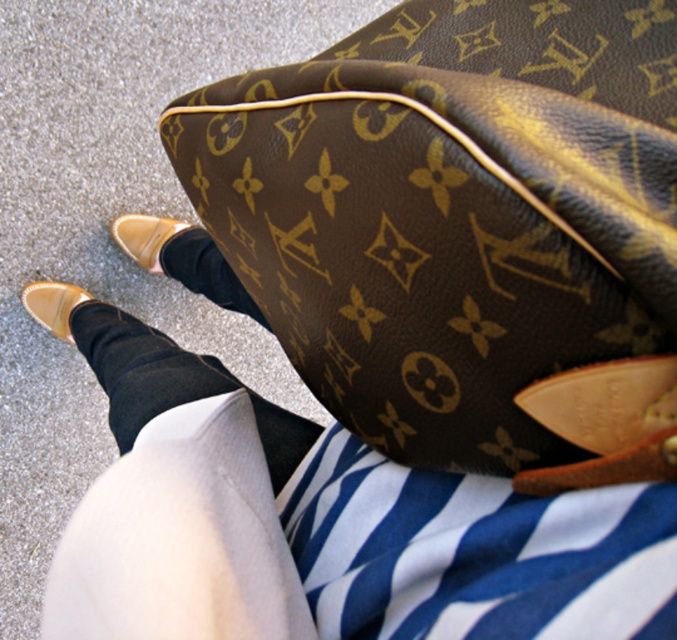
Question: Is black glittery sock at lower center thinner than black smooth sock at lower center?

Choices:
 (A) no
 (B) yes

Answer: (A)

Question: Based on their relative distances, which object is farther from the black smooth sock at lower center?

Choices:
 (A) matte tan leather shoe at lower left
 (B) brown monogrammed leather handbag at center

Answer: (B)

Question: Can you confirm if black glittery sock at lower center is smaller than black smooth sock at lower center?

Choices:
 (A) no
 (B) yes

Answer: (A)

Question: Which point is farther from the camera taking this photo?

Choices:
 (A) (238, 454)
 (B) (49, 326)
 (C) (202, 355)
 (D) (144, 246)

Answer: (D)

Question: Based on their relative distances, which object is farther from the tan leather shoe at lower left?

Choices:
 (A) matte tan leather shoe at lower left
 (B) black smooth sock at lower center
 (C) black glittery sock at lower center
 (D) brown monogrammed leather handbag at center

Answer: (D)

Question: Does black smooth sock at lower center appear on the right side of matte tan leather shoe at lower left?

Choices:
 (A) no
 (B) yes

Answer: (B)